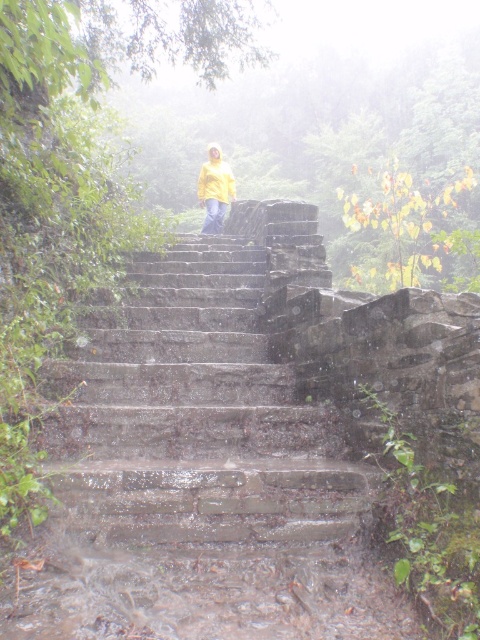
Question: Is the position of wet stone stairs at center less distant than that of yellow matte jacket at center?

Choices:
 (A) no
 (B) yes

Answer: (B)

Question: Observing the image, what is the correct spatial positioning of wet stone stairs at center in reference to yellow matte jacket at center?

Choices:
 (A) left
 (B) right

Answer: (B)

Question: Is wet stone stairs at center further to camera compared to yellow matte jacket at center?

Choices:
 (A) yes
 (B) no

Answer: (B)

Question: Which point is closer to the camera?

Choices:
 (A) wet stone stairs at center
 (B) yellow matte jacket at center

Answer: (A)

Question: Among these points, which one is farthest from the camera?

Choices:
 (A) (212, 230)
 (B) (103, 472)

Answer: (A)